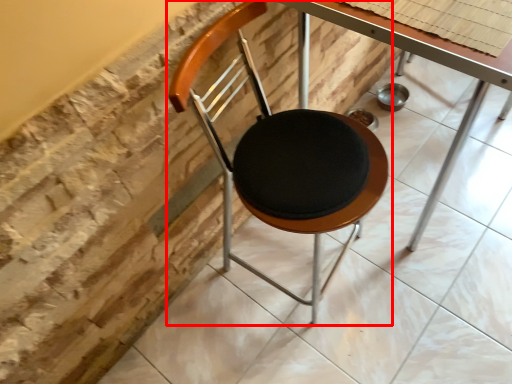
Question: From the image's perspective, where is chair (annotated by the red box) located in relation to table in the image?

Choices:
 (A) above
 (B) below

Answer: (B)